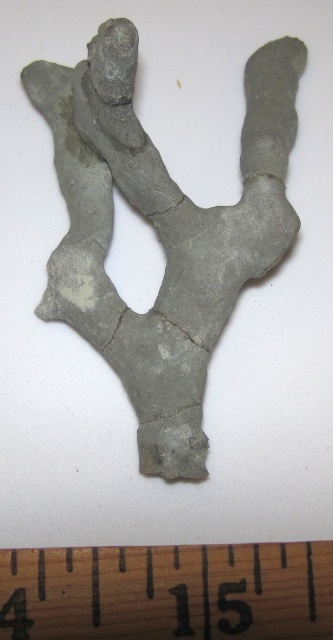
Question: Among these objects, which one is nearest to the camera?

Choices:
 (A) wooden ruler at bottom
 (B) gray clay sculpture at center

Answer: (A)

Question: Can you confirm if gray clay sculpture at center is thinner than wooden ruler at bottom?

Choices:
 (A) no
 (B) yes

Answer: (B)

Question: Which object appears farthest from the camera in this image?

Choices:
 (A) wooden ruler at bottom
 (B) gray clay sculpture at center

Answer: (B)

Question: Which object is farther from the camera taking this photo?

Choices:
 (A) gray clay sculpture at center
 (B) wooden ruler at bottom

Answer: (A)

Question: Can you confirm if gray clay sculpture at center is positioned below wooden ruler at bottom?

Choices:
 (A) yes
 (B) no

Answer: (B)

Question: Is gray clay sculpture at center smaller than wooden ruler at bottom?

Choices:
 (A) yes
 (B) no

Answer: (B)